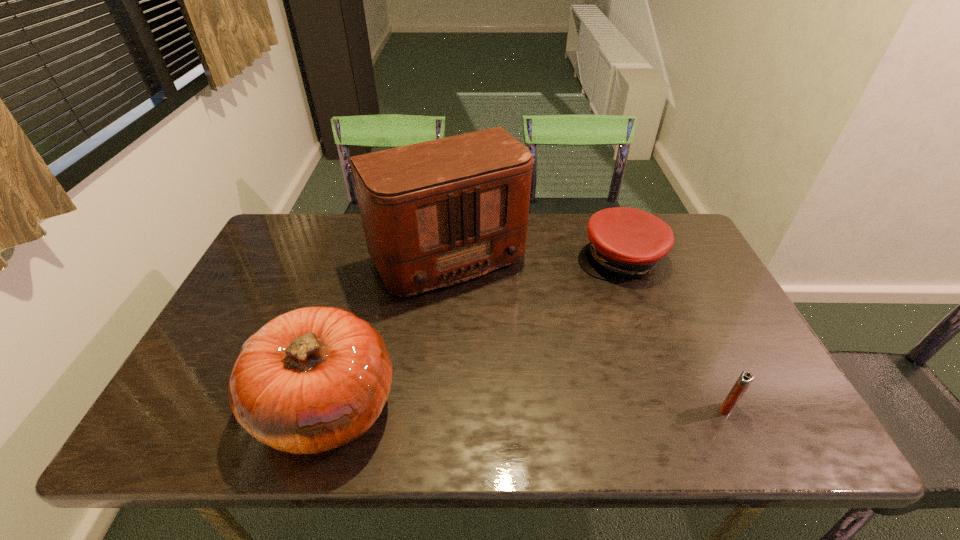
What are the coordinates of `vacant area situated at the front of the cap where the visor is located` in the screenshot? It's located at (588, 380).

What are the coordinates of `vacant space located at the front of the cap where the visor is located` in the screenshot? It's located at (591, 367).

This screenshot has height=540, width=960. I want to click on radio receiver situated at the far edge, so click(x=436, y=213).

I want to click on cap present at the far edge, so click(625, 242).

The width and height of the screenshot is (960, 540). Identify the location of pumpkin situated at the near edge. (311, 380).

Locate an element on the screen. igniter positioned at the near edge is located at coordinates (746, 378).

In order to click on igniter located at the right edge in this screenshot , I will do `click(746, 378)`.

Where is `cap present at the right edge`? cap present at the right edge is located at coordinates (625, 242).

Where is `object that is at the far right corner`? object that is at the far right corner is located at coordinates pyautogui.click(x=625, y=242).

Find the location of a particular element. The height and width of the screenshot is (540, 960). object at the near right corner is located at coordinates (746, 378).